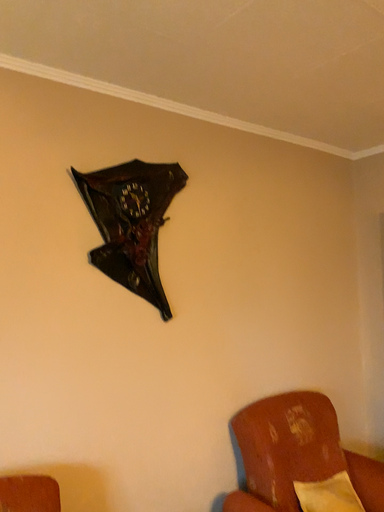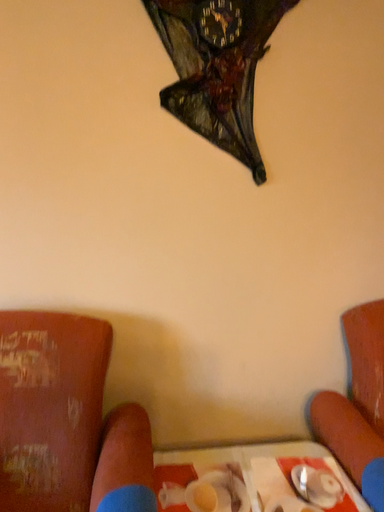
Question: Which way did the camera rotate in the video?

Choices:
 (A) rotated right
 (B) rotated left

Answer: (B)